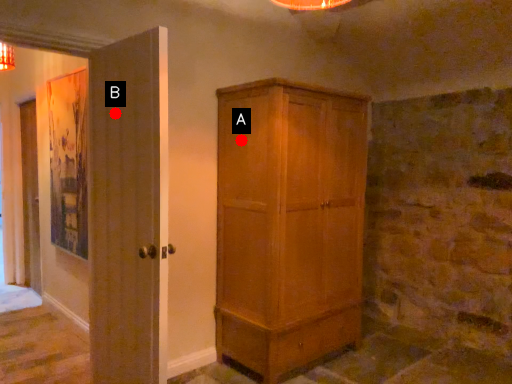
Question: Two points are circled on the image, labeled by A and B beside each circle. Which point is farther to the camera?

Choices:
 (A) A is further
 (B) B is further

Answer: (A)